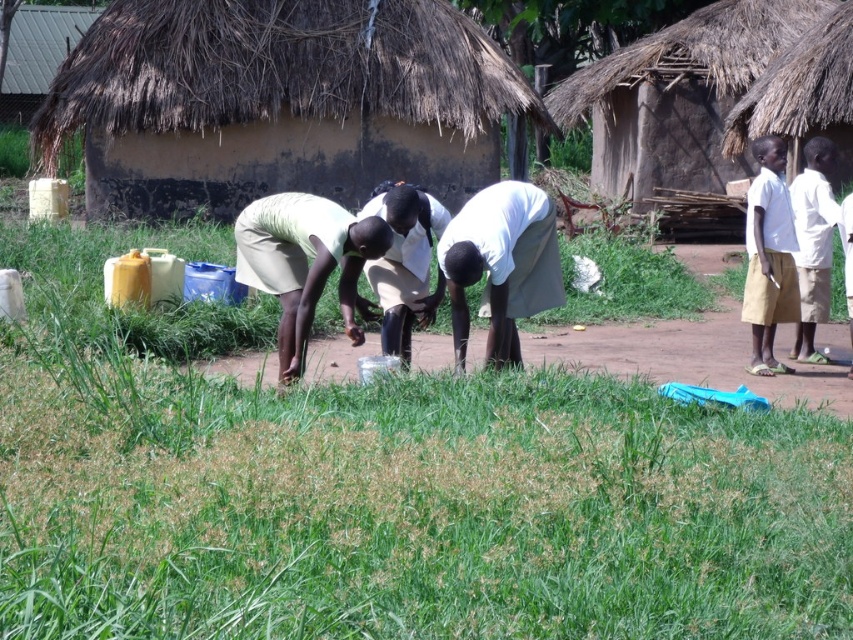
You are a visitor in this village and want to know which object is smaller between the thatched straw hut at upper center and the white cotton shirt at center. Can you tell me?

The thatched straw hut at upper center is smaller than the white cotton shirt at center.

You are a visitor in this village and want to take a photo of the thatched straw hut at upper right without including the white cotton shirt at upper right in the frame. Which direction should you move to achieve this?

Move to the left side of the scene. Since the thatched straw hut at upper right is positioned on the right side of the white cotton shirt at upper right, moving left would shift the perspective so the thatched straw hut at upper right is framed away from the white cotton shirt at upper right.

You are standing at the point labeled point (x=624, y=52) and want to walk to the point labeled point (x=170, y=179). Which direction should you move to reach your destination?

You should move forward because point (x=170, y=179) is in front of point (x=624, y=52).